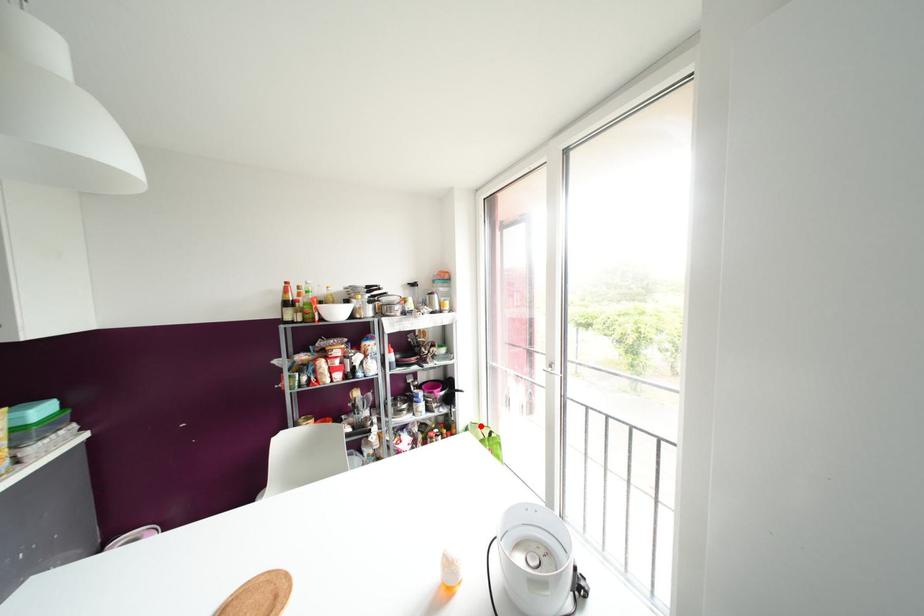
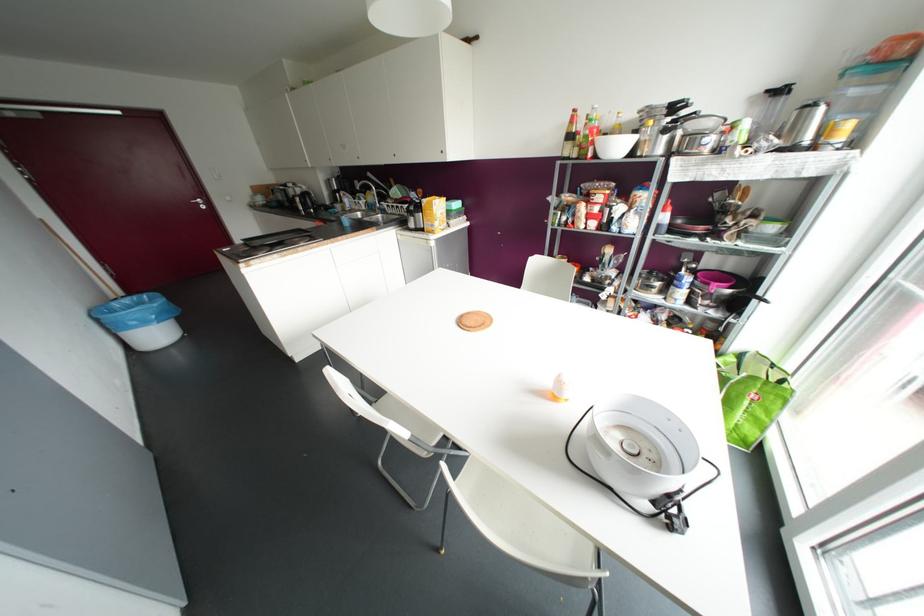
Question: I am providing you with two images of the same scene from different viewpoints. A red point is marked on the first image. Is the red point's position out of view in image 2?

Choices:
 (A) Yes
 (B) No

Answer: (B)